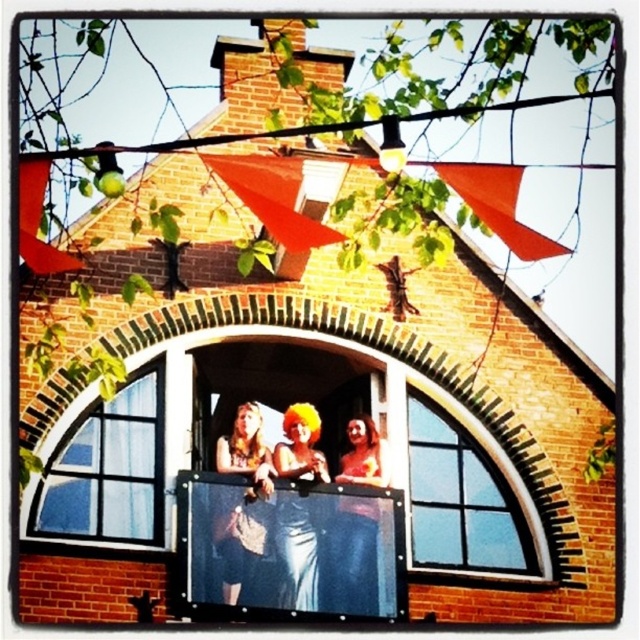
You are standing in front of the brick building and notice the clear glass window at center and the matte blue jeans at center. Which object is located higher up?

The clear glass window at center is positioned over the matte blue jeans at center, so it is higher up.

You are a painter who needs to cover the clear glass window at center and the matte blue jeans at center with a single sheet of canvas. The canvas is exactly the width of the wider object. Which object determines the minimum required width of the canvas?

The clear glass window at center is wider than matte blue jeans at center, so the canvas must be at least as wide as the clear glass window at center to cover both objects.